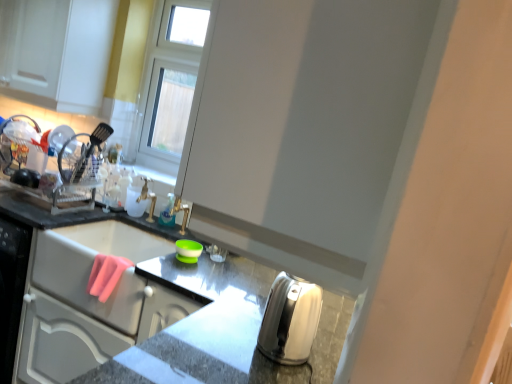
This screenshot has width=512, height=384. I want to click on vacant space to the right of green rubber bowl at center, which is counted as the first appliance, starting from the back, so click(x=223, y=270).